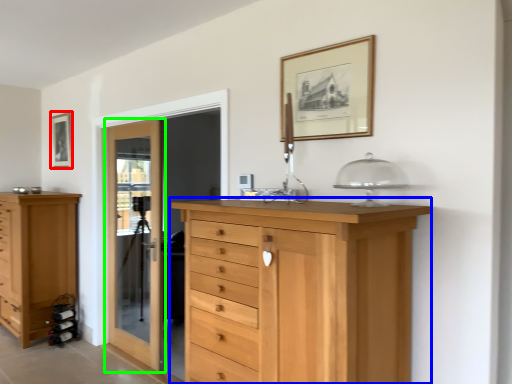
Question: Considering the real-world distances, which object is farthest from picture frame (highlighted by a red box)? chest of drawers (highlighted by a blue box) or door (highlighted by a green box)?

Choices:
 (A) chest of drawers
 (B) door

Answer: (A)